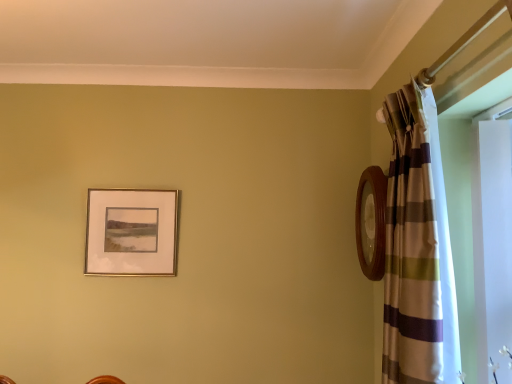
Question: From the image's perspective, is gold metallic picture frame at upper left on striped fabric curtain at right?

Choices:
 (A) no
 (B) yes

Answer: (A)

Question: Could you tell me if gold metallic picture frame at upper left is turned towards striped fabric curtain at right?

Choices:
 (A) no
 (B) yes

Answer: (A)

Question: Is gold metallic picture frame at upper left to the right of striped fabric curtain at right from the viewer's perspective?

Choices:
 (A) yes
 (B) no

Answer: (B)

Question: Considering the relative positions of gold metallic picture frame at upper left and striped fabric curtain at right in the image provided, is gold metallic picture frame at upper left behind striped fabric curtain at right?

Choices:
 (A) yes
 (B) no

Answer: (A)

Question: Considering the relative sizes of gold metallic picture frame at upper left and striped fabric curtain at right in the image provided, is gold metallic picture frame at upper left bigger than striped fabric curtain at right?

Choices:
 (A) no
 (B) yes

Answer: (A)

Question: Would you say striped fabric curtain at right is part of gold metallic picture frame at upper left's contents?

Choices:
 (A) yes
 (B) no

Answer: (B)

Question: Does striped fabric curtain at right lie in front of gold metallic picture frame at upper left?

Choices:
 (A) no
 (B) yes

Answer: (B)

Question: Is striped fabric curtain at right directly adjacent to gold metallic picture frame at upper left?

Choices:
 (A) no
 (B) yes

Answer: (A)

Question: Does striped fabric curtain at right have a lesser height compared to gold metallic picture frame at upper left?

Choices:
 (A) no
 (B) yes

Answer: (A)

Question: Does striped fabric curtain at right have a greater width compared to gold metallic picture frame at upper left?

Choices:
 (A) no
 (B) yes

Answer: (B)

Question: From the image's perspective, is striped fabric curtain at right below gold metallic picture frame at upper left?

Choices:
 (A) no
 (B) yes

Answer: (A)

Question: Is striped fabric curtain at right at the right side of gold metallic picture frame at upper left?

Choices:
 (A) yes
 (B) no

Answer: (A)

Question: From the image's perspective, relative to striped fabric curtain at right, is gold metallic picture frame at upper left above or below?

Choices:
 (A) below
 (B) above

Answer: (A)